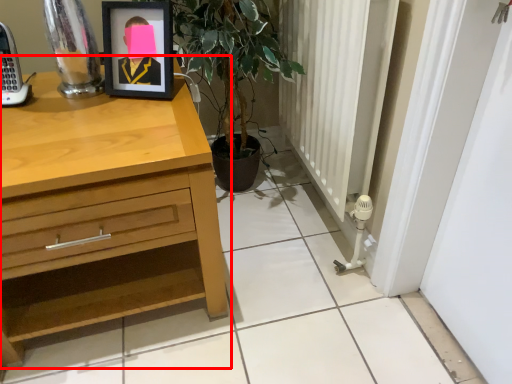
Question: Where is chest of drawers (annotated by the red box) located in relation to picture frame in the image?

Choices:
 (A) right
 (B) left

Answer: (B)